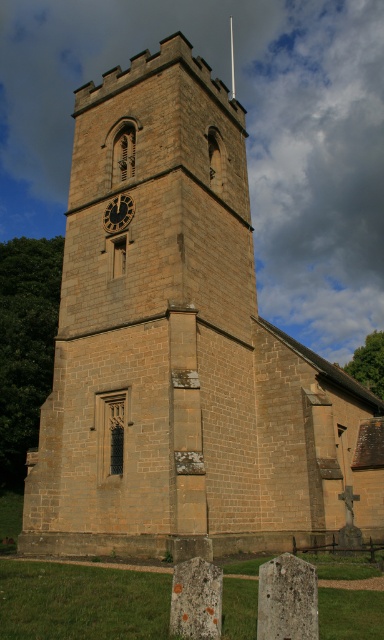
Question: Which object is closer to the camera taking this photo?

Choices:
 (A) smooth stone spire at upper center
 (B) dark brown stone clock at center

Answer: (B)

Question: Does dark brown stone clock at center have a greater width compared to smooth stone spire at upper center?

Choices:
 (A) yes
 (B) no

Answer: (B)

Question: Which object is farther from the camera taking this photo?

Choices:
 (A) dark brown stone clock at center
 (B) smooth stone spire at upper center

Answer: (B)

Question: Observing the image, what is the correct spatial positioning of dark brown stone clock at center in reference to smooth stone spire at upper center?

Choices:
 (A) right
 (B) left

Answer: (B)

Question: Can you confirm if dark brown stone clock at center is bigger than smooth stone spire at upper center?

Choices:
 (A) no
 (B) yes

Answer: (A)